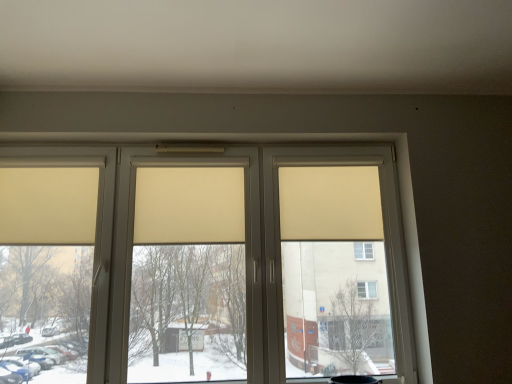
Question: Is beige fabric curtain at left, the first curtain in the left-to-right sequence, to the left of beige matte window at center from the viewer's perspective?

Choices:
 (A) no
 (B) yes

Answer: (B)

Question: Is beige fabric curtain at left, which is the 3th curtain in right-to-left order, facing away from beige matte window at center?

Choices:
 (A) no
 (B) yes

Answer: (B)

Question: Can you confirm if beige fabric curtain at left, the first curtain in the left-to-right sequence, is bigger than beige matte window at center?

Choices:
 (A) yes
 (B) no

Answer: (B)

Question: Can you confirm if beige fabric curtain at left, which is the 3th curtain in right-to-left order, is taller than beige matte window at center?

Choices:
 (A) yes
 (B) no

Answer: (B)

Question: Can you confirm if beige fabric curtain at left, which is the 3th curtain in right-to-left order, is positioned to the right of beige matte window at center?

Choices:
 (A) no
 (B) yes

Answer: (A)

Question: Visually, is beige fabric curtain at left, the first curtain in the left-to-right sequence, positioned to the left or to the right of beige fabric curtain at center, which is counted as the 1th curtain, starting from the right?

Choices:
 (A) right
 (B) left

Answer: (B)

Question: From a real-world perspective, relative to beige fabric curtain at center, placed as the third curtain when sorted from left to right, is beige fabric curtain at left, which is the 3th curtain in right-to-left order, vertically above or below?

Choices:
 (A) below
 (B) above

Answer: (A)

Question: Is beige fabric curtain at left, which is the 3th curtain in right-to-left order, bigger or smaller than beige fabric curtain at center, which is counted as the 1th curtain, starting from the right?

Choices:
 (A) small
 (B) big

Answer: (A)

Question: Is beige fabric curtain at left, the first curtain in the left-to-right sequence, taller or shorter than beige fabric curtain at center, which is counted as the 1th curtain, starting from the right?

Choices:
 (A) tall
 (B) short

Answer: (A)

Question: Considering the positions of beige matte window at center and beige fabric curtain at left, which is the 3th curtain in right-to-left order, in the image, is beige matte window at center wider or thinner than beige fabric curtain at left, which is the 3th curtain in right-to-left order,?

Choices:
 (A) wide
 (B) thin

Answer: (A)

Question: From their relative heights in the image, would you say beige matte window at center is taller or shorter than beige fabric curtain at left, the first curtain in the left-to-right sequence?

Choices:
 (A) tall
 (B) short

Answer: (A)

Question: Would you say beige matte window at center is to the left or to the right of beige fabric curtain at left, the first curtain in the left-to-right sequence, in the picture?

Choices:
 (A) right
 (B) left

Answer: (A)

Question: From a real-world perspective, is beige matte window at center physically located above or below beige fabric curtain at left, the first curtain in the left-to-right sequence?

Choices:
 (A) above
 (B) below

Answer: (B)

Question: Looking at their shapes, would you say beige fabric curtain at center, which is counted as the 1th curtain, starting from the right, is wider or thinner than beige fabric curtain at left, which is the 3th curtain in right-to-left order?

Choices:
 (A) wide
 (B) thin

Answer: (A)

Question: From the image's perspective, relative to beige fabric curtain at left, the first curtain in the left-to-right sequence, is beige fabric curtain at center, which is counted as the 1th curtain, starting from the right, above or below?

Choices:
 (A) above
 (B) below

Answer: (A)